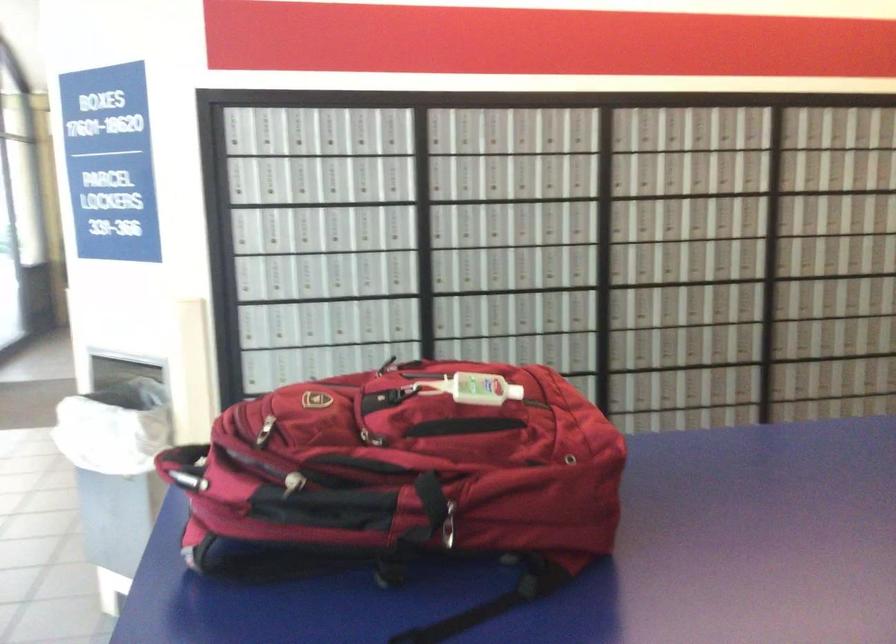
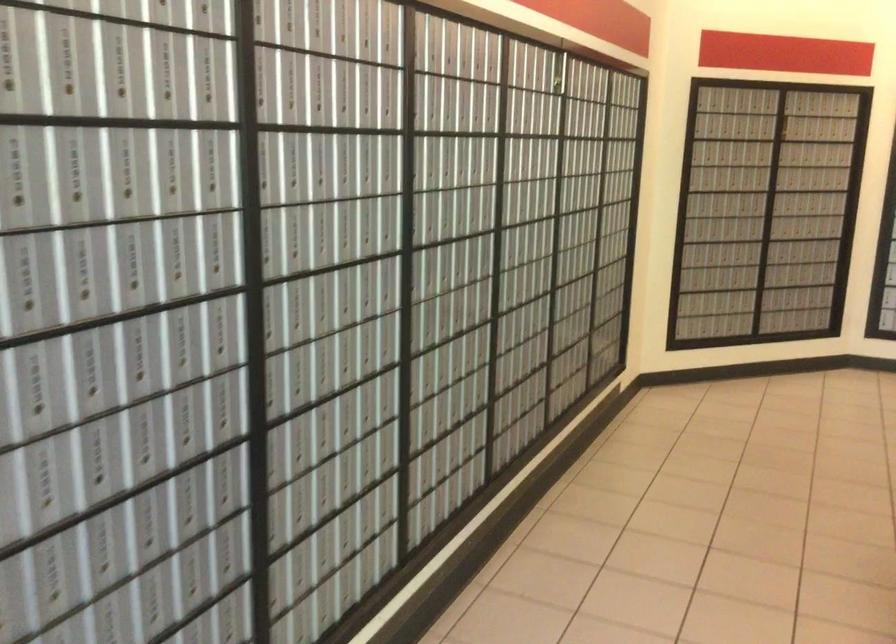
Find the pixel in the second image that matches pixel 511 281 in the first image.

(329, 252)